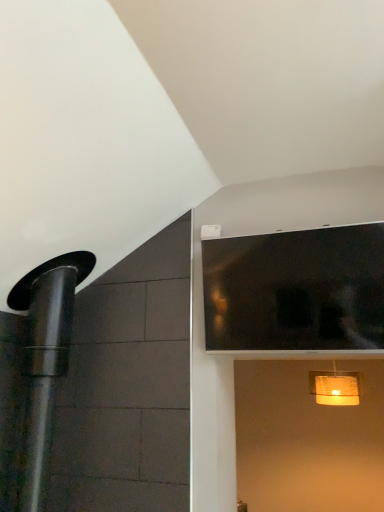
Question: Does matte yellow lampshade at lower right lie in front of black glass window at upper right?

Choices:
 (A) no
 (B) yes

Answer: (A)

Question: Considering the relative sizes of matte yellow lampshade at lower right and black glass window at upper right in the image provided, is matte yellow lampshade at lower right taller than black glass window at upper right?

Choices:
 (A) no
 (B) yes

Answer: (A)

Question: Is matte yellow lampshade at lower right not inside black glass window at upper right?

Choices:
 (A) yes
 (B) no

Answer: (A)

Question: Is matte yellow lampshade at lower right to the left of black glass window at upper right from the viewer's perspective?

Choices:
 (A) yes
 (B) no

Answer: (B)

Question: Is matte yellow lampshade at lower right far away from black glass window at upper right?

Choices:
 (A) no
 (B) yes

Answer: (B)

Question: Is matte yellow lampshade at lower right oriented towards black glass window at upper right?

Choices:
 (A) no
 (B) yes

Answer: (B)

Question: Does black glass window at upper right touch matte yellow lampshade at lower right?

Choices:
 (A) yes
 (B) no

Answer: (B)

Question: Considering the relative sizes of black glass window at upper right and matte yellow lampshade at lower right in the image provided, is black glass window at upper right shorter than matte yellow lampshade at lower right?

Choices:
 (A) no
 (B) yes

Answer: (A)

Question: From the image's perspective, is black glass window at upper right above matte yellow lampshade at lower right?

Choices:
 (A) yes
 (B) no

Answer: (A)

Question: From the image's perspective, is black glass window at upper right under matte yellow lampshade at lower right?

Choices:
 (A) yes
 (B) no

Answer: (B)

Question: Considering the relative positions of black glass window at upper right and matte yellow lampshade at lower right in the image provided, is black glass window at upper right to the left of matte yellow lampshade at lower right from the viewer's perspective?

Choices:
 (A) yes
 (B) no

Answer: (A)

Question: Considering the relative sizes of black glass window at upper right and matte yellow lampshade at lower right in the image provided, is black glass window at upper right taller than matte yellow lampshade at lower right?

Choices:
 (A) yes
 (B) no

Answer: (A)

Question: Based on their sizes in the image, would you say matte yellow lampshade at lower right is bigger or smaller than black glass window at upper right?

Choices:
 (A) small
 (B) big

Answer: (A)